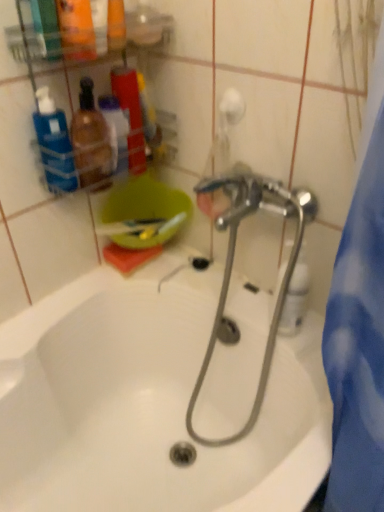
Question: Is translucent plastic bottles at upper left, which is the second toiletry from left to right, facing towards white glossy bathtub at center?

Choices:
 (A) yes
 (B) no

Answer: (B)

Question: Is translucent plastic bottles at upper left, which is counted as the 1th toiletry, starting from the right, oriented away from white glossy bathtub at center?

Choices:
 (A) yes
 (B) no

Answer: (B)

Question: Is translucent plastic bottles at upper left, which is counted as the 1th toiletry, starting from the right, to the left of white glossy bathtub at center from the viewer's perspective?

Choices:
 (A) yes
 (B) no

Answer: (A)

Question: Does translucent plastic bottles at upper left, which is counted as the 1th toiletry, starting from the right, have a larger size compared to white glossy bathtub at center?

Choices:
 (A) no
 (B) yes

Answer: (A)

Question: From the image's perspective, is translucent plastic bottles at upper left, which is the second toiletry from left to right, located above white glossy bathtub at center?

Choices:
 (A) no
 (B) yes

Answer: (B)

Question: From their relative heights in the image, would you say translucent plastic bottles at upper left, which is the second toiletry from left to right, is taller or shorter than blue plastic bottle at upper left, the 2th cleaning product when ordered from right to left?

Choices:
 (A) short
 (B) tall

Answer: (B)

Question: In terms of size, does translucent plastic bottles at upper left, which is counted as the 1th toiletry, starting from the right, appear bigger or smaller than blue plastic bottle at upper left, the 1th cleaning product in the top-to-bottom sequence?

Choices:
 (A) small
 (B) big

Answer: (B)

Question: From the image's perspective, is translucent plastic bottles at upper left, which is the second toiletry from left to right, positioned above or below blue plastic bottle at upper left, the 2th cleaning product when ordered from right to left?

Choices:
 (A) below
 (B) above

Answer: (B)

Question: Is translucent plastic bottles at upper left, which is counted as the 1th toiletry, starting from the right, inside or outside of blue plastic bottle at upper left, the 1th cleaning product in the top-to-bottom sequence?

Choices:
 (A) outside
 (B) inside

Answer: (A)

Question: Relative to white glossy bathtub at center, is blue plastic bottle at upper left, which ranks as the 2th cleaning product in bottom-to-top order, in front or behind?

Choices:
 (A) behind
 (B) front

Answer: (A)

Question: In terms of size, does blue plastic bottle at upper left, placed as the first cleaning product when sorted from left to right, appear bigger or smaller than white glossy bathtub at center?

Choices:
 (A) small
 (B) big

Answer: (A)

Question: From the image's perspective, is blue plastic bottle at upper left, placed as the first cleaning product when sorted from left to right, above or below white glossy bathtub at center?

Choices:
 (A) below
 (B) above

Answer: (B)

Question: Considering the relative positions of blue plastic bottle at upper left, placed as the first cleaning product when sorted from left to right, and white glossy bathtub at center in the image provided, is blue plastic bottle at upper left, placed as the first cleaning product when sorted from left to right, to the left or to the right of white glossy bathtub at center?

Choices:
 (A) left
 (B) right

Answer: (A)

Question: Is point (36, 479) closer or farther from the camera than point (102, 145)?

Choices:
 (A) farther
 (B) closer

Answer: (A)

Question: Is white glossy bathtub at center inside or outside of translucent plastic bottles at left, arranged as the 1th toiletry when viewed from the left?

Choices:
 (A) inside
 (B) outside

Answer: (B)